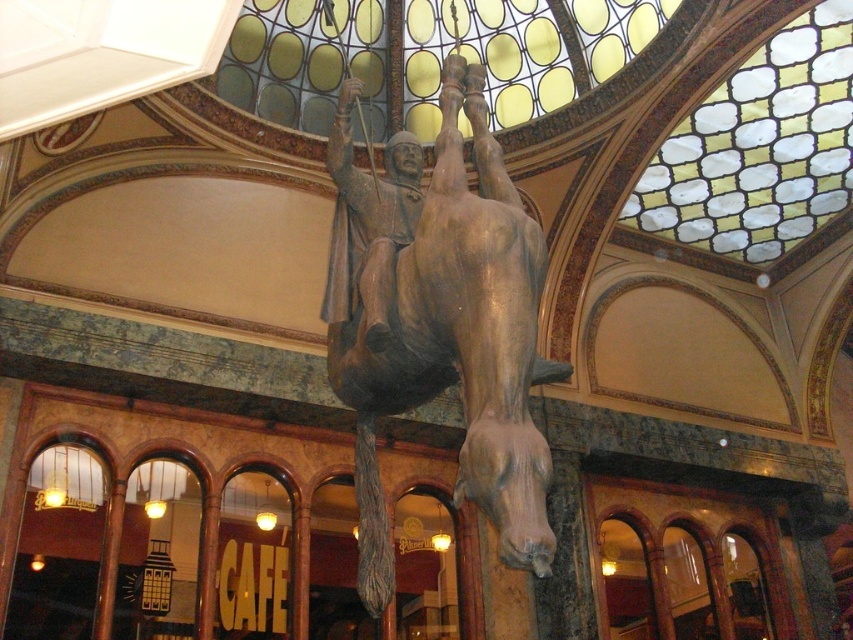
You are an art conservator examining the interior space. You notice the stained glass window at upper center and the wooden statue at center. Which object is positioned higher in the vertical plane?

The stained glass window at upper center is located above the wooden statue at center, so it is positioned higher in the vertical plane.

You are an architect designing a new museum and want to replicate the lighting effect from the image. The stained glass window at upper center and the stained glass mosaic at upper center are crucial for the ambiance. Given that the two elements are 20.42 meters apart, can you confirm if this distance is sufficient to ensure that both contribute equally to the lighting in the central area below?

The stained glass window at upper center and stained glass mosaic at upper center are 20.42 meters apart. Since they are equidistant from the central area below, both will contribute equally to the lighting ambiance.